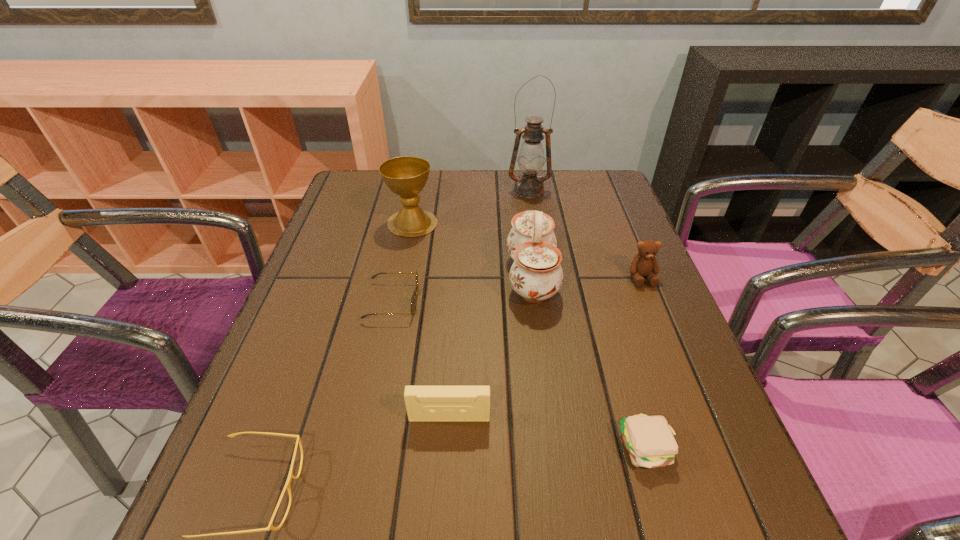
Locate an element on the screen. This screenshot has width=960, height=540. free space that satisfies the following two spatial constraints: 1. on the face of the rightmost object; 2. on the lenses of the sunglasses is located at coordinates (652, 301).

The image size is (960, 540). In order to click on free space that satisfies the following two spatial constraints: 1. on the front side of the oil lamp; 2. by the handle of the chinaware in this screenshot , I will do pyautogui.click(x=542, y=277).

At what (x,y) coordinates should I click in order to perform the action: click on vacant space that satisfies the following two spatial constraints: 1. on the lenses of the sunglasses; 2. on the back side of the patty. Please return your answer as a coordinate pair (x, y). This screenshot has height=540, width=960. Looking at the image, I should click on (363, 448).